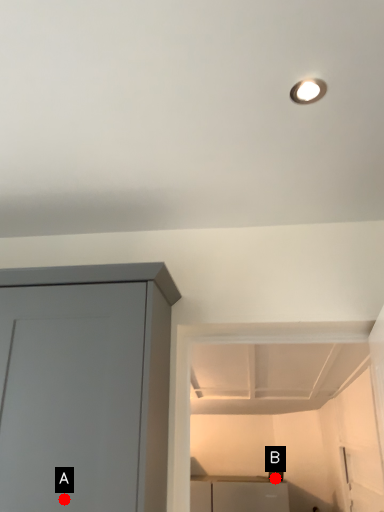
Question: Two points are circled on the image, labeled by A and B beside each circle. Which point is closer to the camera taking this photo?

Choices:
 (A) A is closer
 (B) B is closer

Answer: (A)